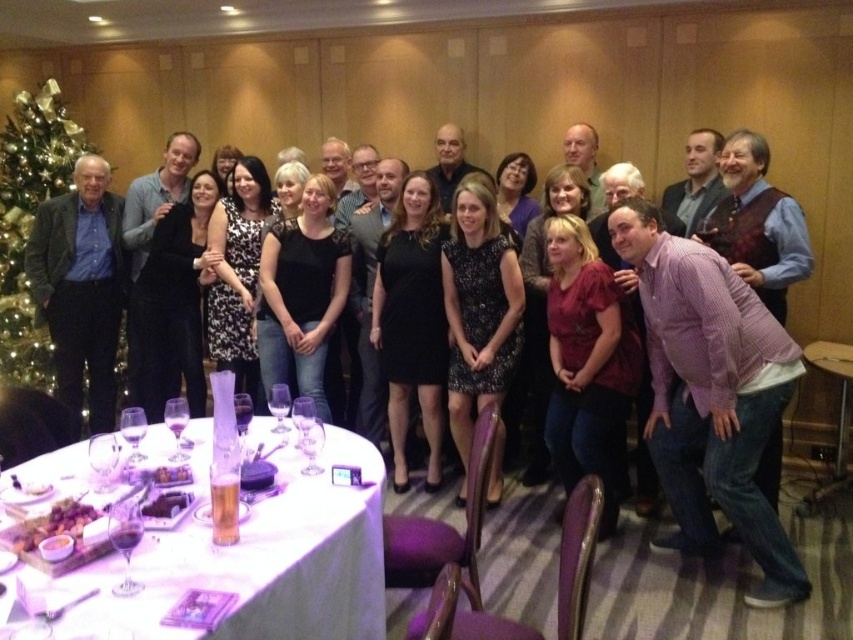
Can you confirm if green glittering christmas tree at left is bigger than wooden table at lower right?

Yes, green glittering christmas tree at left is bigger than wooden table at lower right.

Between green glittering christmas tree at left and wooden table at lower right, which one has more height?

green glittering christmas tree at left

Between point (50, 368) and point (840, 468), which one is positioned in front?

Point (840, 468)

Find the location of `green glittering christmas tree at left`. green glittering christmas tree at left is located at coordinates (30, 224).

Does white cloth-covered table at lower left come in front of wooden table at lower right?

Yes, it is in front of wooden table at lower right.

Is white cloth-covered table at lower left to the left of wooden table at lower right from the viewer's perspective?

Indeed, white cloth-covered table at lower left is positioned on the left side of wooden table at lower right.

I want to click on white cloth-covered table at lower left, so click(x=251, y=564).

Is point (167, 561) behind point (24, 228)?

No, it is not.

Which is behind, point (350, 577) or point (82, 147)?

Point (82, 147)

Describe the element at coordinates (251, 564) in the screenshot. The height and width of the screenshot is (640, 853). I see `white cloth-covered table at lower left` at that location.

Where is `white cloth-covered table at lower left`? Image resolution: width=853 pixels, height=640 pixels. white cloth-covered table at lower left is located at coordinates (251, 564).